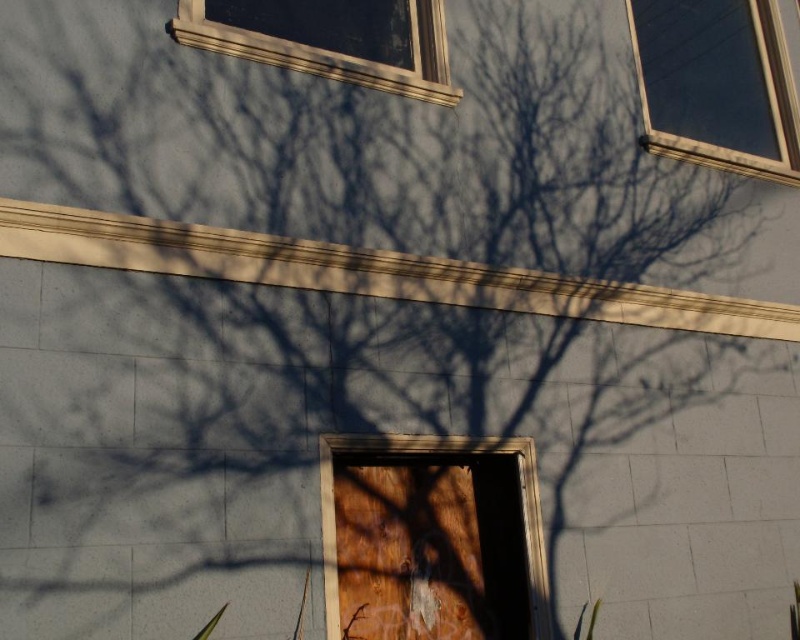
In the scene shown: You are standing in front of the building and notice two clear glass windows. The clear glass window at upper right and the clear glass window at upper center. Which window would allow more natural light into the room?

The clear glass window at upper right is bigger than the clear glass window at upper center, so it would allow more natural light into the room.